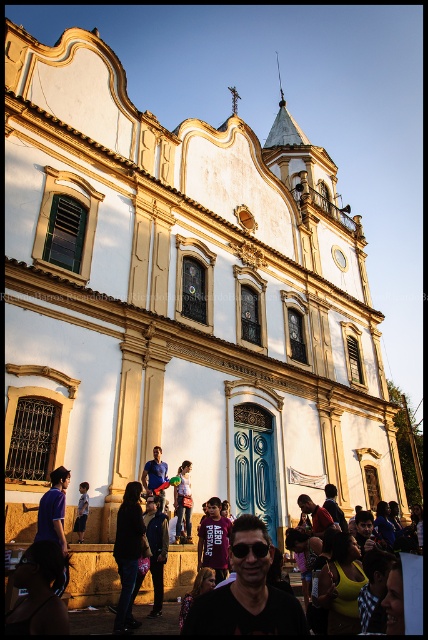
Question: Can you confirm if yellow-green fabric at lower center is positioned above dark blue jeans at center?

Choices:
 (A) yes
 (B) no

Answer: (A)

Question: Which object is farther from the camera taking this photo?

Choices:
 (A) dark brown leather jacket at lower left
 (B) matte black sunglasses at center

Answer: (B)

Question: Can you confirm if matte black sunglasses at center is positioned below dark blue jeans at center?

Choices:
 (A) no
 (B) yes

Answer: (A)

Question: Which object is farther from the camera taking this photo?

Choices:
 (A) black matte dress at center
 (B) denim jacket at lower center
 (C) maroon jersey at center
 (D) yellow-green fabric at lower center

Answer: (C)

Question: Which object is closer to the camera taking this photo?

Choices:
 (A) matte black sunglasses at center
 (B) maroon jersey at center

Answer: (A)

Question: Where is dark brown leather jacket at lower left located in relation to maroon jersey at center in the image?

Choices:
 (A) below
 (B) above

Answer: (B)